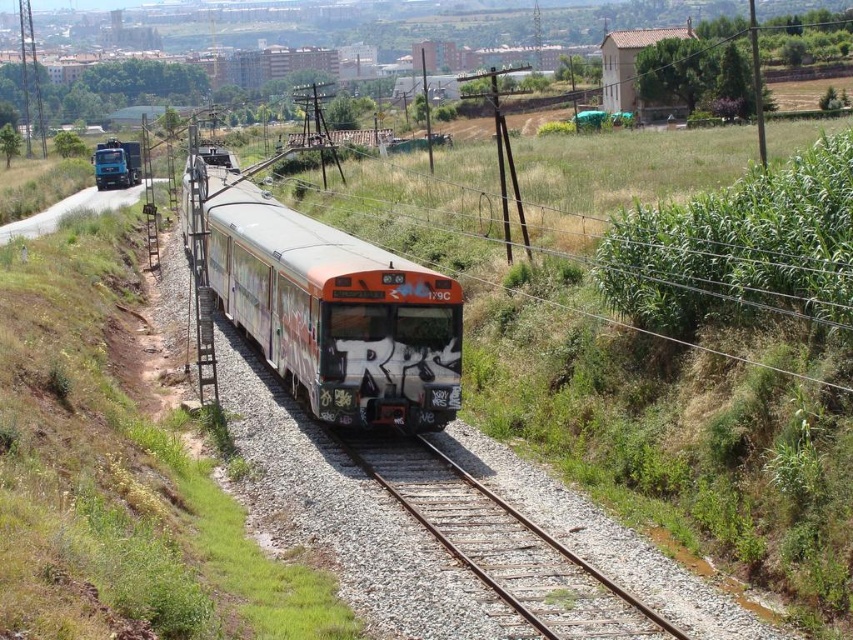
Can you confirm if white painted graffiti-covered train at center is smaller than metal/gravel train track at center?

No, white painted graffiti-covered train at center is not smaller than metal/gravel train track at center.

Can you confirm if white painted graffiti-covered train at center is positioned to the right of metal/gravel train track at center?

No, white painted graffiti-covered train at center is not to the right of metal/gravel train track at center.

Based on the photo, who is more distant from viewer, (276, 296) or (523, 520)?

Point (276, 296)

I want to click on white painted graffiti-covered train at center, so pos(335,312).

Is metal/gravel train track at center smaller than brushed metal truck at left?

Yes.

Who is higher up, metal/gravel train track at center or brushed metal truck at left?

brushed metal truck at left is higher up.

Does point (387, 456) come closer to viewer compared to point (111, 145)?

Yes, point (387, 456) is in front of point (111, 145).

You are a GUI agent. You are given a task and a screenshot of the screen. Output one action in this format:
    pyautogui.click(x=<x>, y=<y>)
    Task: Click on the metal/gravel train track at center
    Image resolution: width=853 pixels, height=640 pixels.
    Given the screenshot: What is the action you would take?
    pyautogui.click(x=502, y=544)

Does point (338, 256) come closer to viewer compared to point (97, 157)?

Yes, it is.

At what (x,y) coordinates should I click in order to perform the action: click on white painted graffiti-covered train at center. Please return your answer as a coordinate pair (x, y). Looking at the image, I should click on (335, 312).

Locate an element on the screen. The width and height of the screenshot is (853, 640). white painted graffiti-covered train at center is located at coordinates (335, 312).